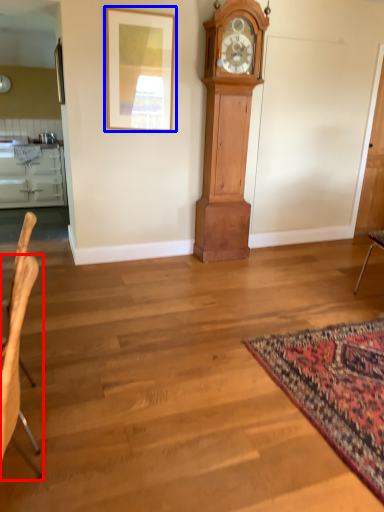
Question: Which object appears farthest to the camera in this image, chair (highlighted by a red box) or picture frame (highlighted by a blue box)?

Choices:
 (A) chair
 (B) picture frame

Answer: (B)